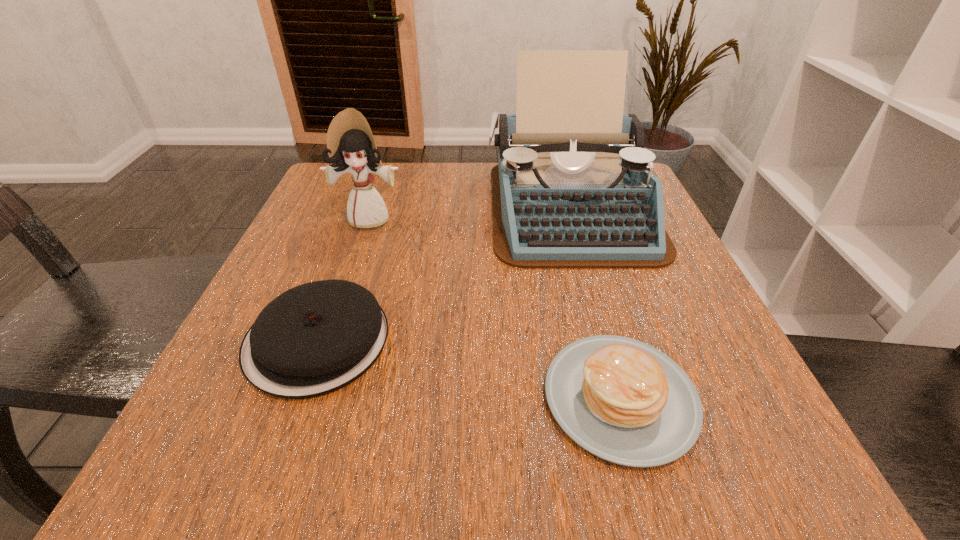
In the image, there is a desktop. Where is `vacant space at the far edge`? Image resolution: width=960 pixels, height=540 pixels. vacant space at the far edge is located at coordinates pyautogui.click(x=413, y=164).

The width and height of the screenshot is (960, 540). What are the coordinates of `vacant space at the near edge of the desktop` in the screenshot? It's located at (405, 465).

At what (x,y) coordinates should I click in order to perform the action: click on vacant space at the left edge. Please return your answer as a coordinate pair (x, y). Image resolution: width=960 pixels, height=540 pixels. Looking at the image, I should click on (254, 299).

The height and width of the screenshot is (540, 960). I want to click on free region at the right edge of the desktop, so click(684, 292).

In the image, there is a desktop. In order to click on blank space at the far left corner in this screenshot , I will do (x=346, y=193).

Where is `vacant area that lies between the third shortest object and the typewriter`? The width and height of the screenshot is (960, 540). vacant area that lies between the third shortest object and the typewriter is located at coordinates (469, 213).

The image size is (960, 540). I want to click on vacant space that's between the doll and the shorter pancake, so click(495, 308).

Find the location of a particular element. Image resolution: width=960 pixels, height=540 pixels. free spot between the second tallest object and the left pancake is located at coordinates (344, 279).

This screenshot has height=540, width=960. Find the location of `free spot between the typewriter and the third shortest object`. free spot between the typewriter and the third shortest object is located at coordinates (469, 213).

I want to click on free point between the right pancake and the typewriter, so click(x=595, y=302).